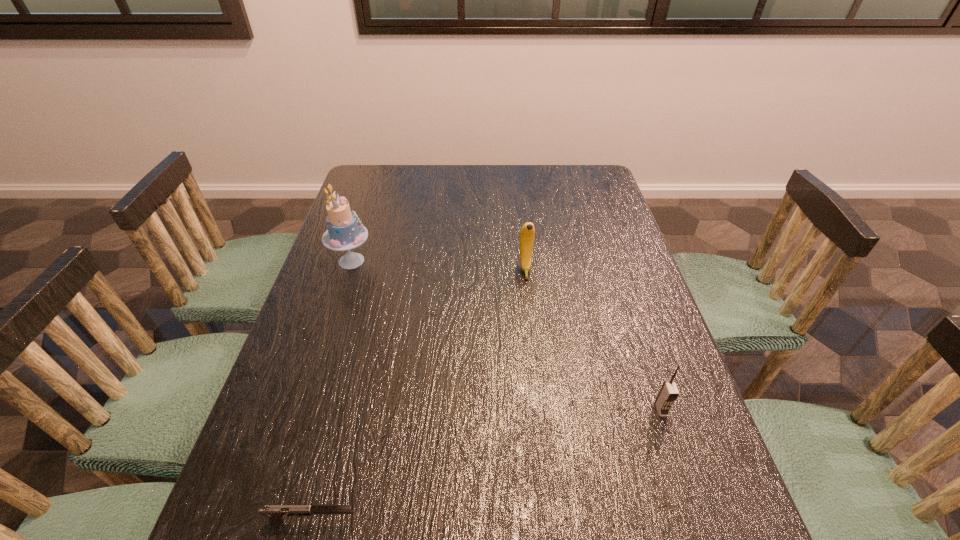
The height and width of the screenshot is (540, 960). Find the location of `vacant point located between the shortest object and the cake`. vacant point located between the shortest object and the cake is located at coordinates (332, 390).

Where is `empty space that is in between the shortest object and the second object from right to left`? This screenshot has width=960, height=540. empty space that is in between the shortest object and the second object from right to left is located at coordinates (419, 395).

Find the location of a particular element. The height and width of the screenshot is (540, 960). vacant space that's between the shortest object and the second object from right to left is located at coordinates (419, 395).

Where is `free space between the tallest object and the gun`? This screenshot has width=960, height=540. free space between the tallest object and the gun is located at coordinates (332, 390).

You are a GUI agent. You are given a task and a screenshot of the screen. Output one action in this format:
    pyautogui.click(x=<x>, y=<y>)
    Task: Click on the blank region between the third farthest object and the banana
    The image size is (960, 540).
    Given the screenshot: What is the action you would take?
    pyautogui.click(x=593, y=340)

Where is `vacant area that lies between the cake and the shortest object`? This screenshot has height=540, width=960. vacant area that lies between the cake and the shortest object is located at coordinates (332, 390).

Select which object appears as the second closest to the gun. Please provide its 2D coordinates. Your answer should be formatted as a tuple, i.e. [(x, y)], where the tuple contains the x and y coordinates of a point satisfying the conditions above.

[(345, 231)]

The image size is (960, 540). Find the location of `the third closest object relative to the third tallest object`. the third closest object relative to the third tallest object is located at coordinates (345, 231).

Find the location of a particular element. Image resolution: width=960 pixels, height=540 pixels. free point that satisfies the following two spatial constraints: 1. on the front-facing side of the cellular telephone; 2. at the muzzle end of the nearest object is located at coordinates (698, 520).

You are a GUI agent. You are given a task and a screenshot of the screen. Output one action in this format:
    pyautogui.click(x=<x>, y=<y>)
    Task: Click on the free space in the image that satisfies the following two spatial constraints: 1. on the front-facing side of the cellular telephone; 2. at the muzzle end of the shortest object
    The height and width of the screenshot is (540, 960).
    Given the screenshot: What is the action you would take?
    pyautogui.click(x=698, y=520)